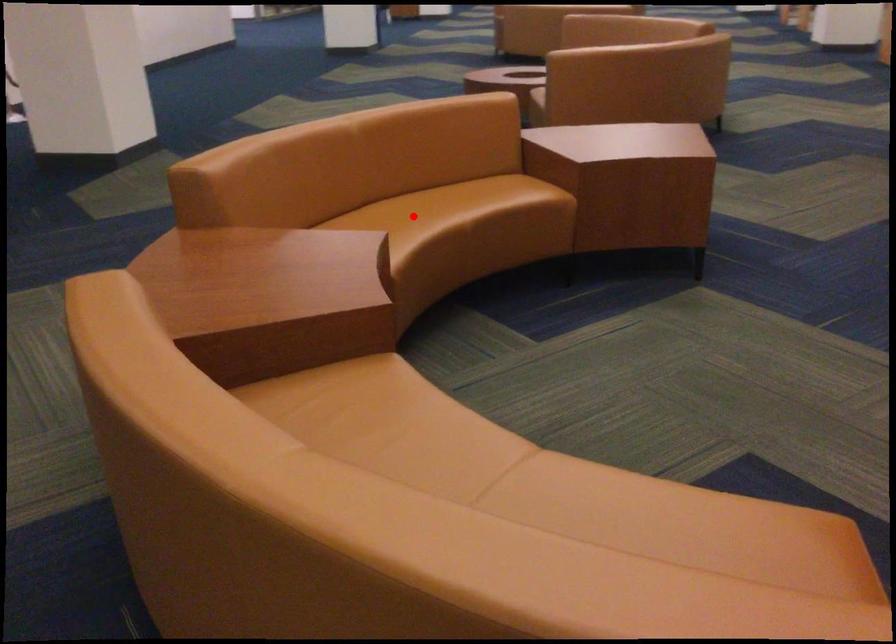
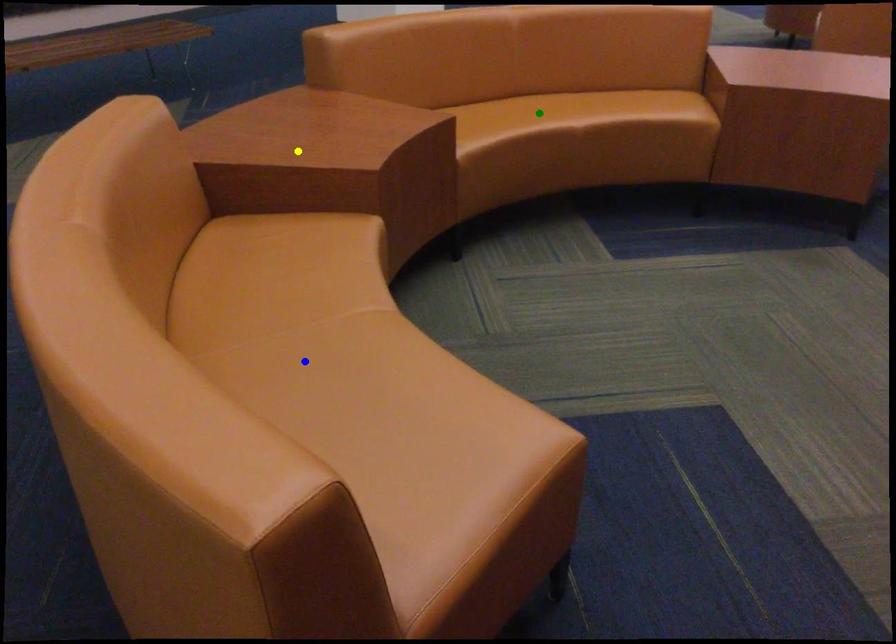
Question: I am providing you with two images of the same scene from different viewpoints. A red point is marked on the first image. You are given multiple points on the second image. Which spot in image 2 lines up with the point in image 1?

Choices:
 (A) yellow point
 (B) blue point
 (C) green point

Answer: (C)